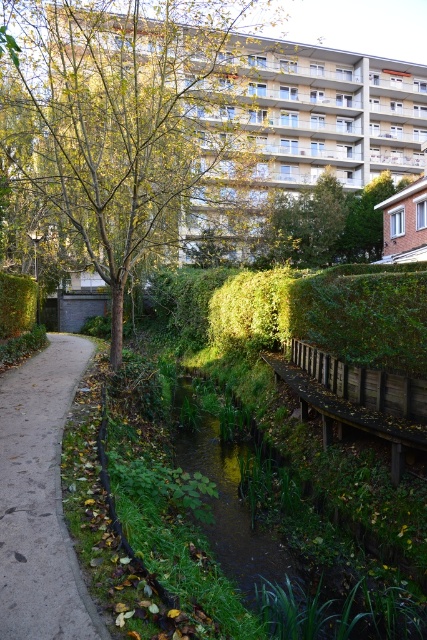
You are standing at the starting point of the pathway to the left of the stream. You want to walk towards the green leafy tree at center. Which direction should you head relative to the stream?

Result: The green leafy tree at center is located at point (128,120) in the scene. Since you are on the pathway to the left of the stream, you should head towards the right to reach the tree as it is positioned centrally in the image.

You are standing at the edge of the green grassy waterway at lower center and want to walk towards the green leafy tree at upper center. Which direction should you head to get closer to the tree?

Since the green grassy waterway at lower center is closer to the viewer than the green leafy tree at upper center, you should head upwards to move towards the tree.

You are standing at the entrance of the pathway and want to walk towards the green leafy tree at center. Which direction should you go relative to the green leafy tree at upper center?

You should go to the left of the green leafy tree at upper center to reach the green leafy tree at center, as the green leafy tree at center is positioned to the left of the green leafy tree at upper center.